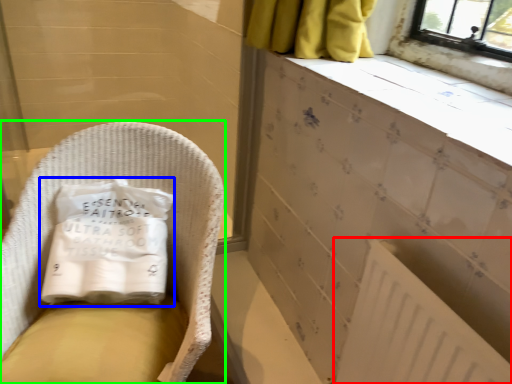
Question: Which is nearer to the radiator (highlighted by a red box)? material (highlighted by a blue box) or furniture (highlighted by a green box).

Choices:
 (A) material
 (B) furniture

Answer: (B)